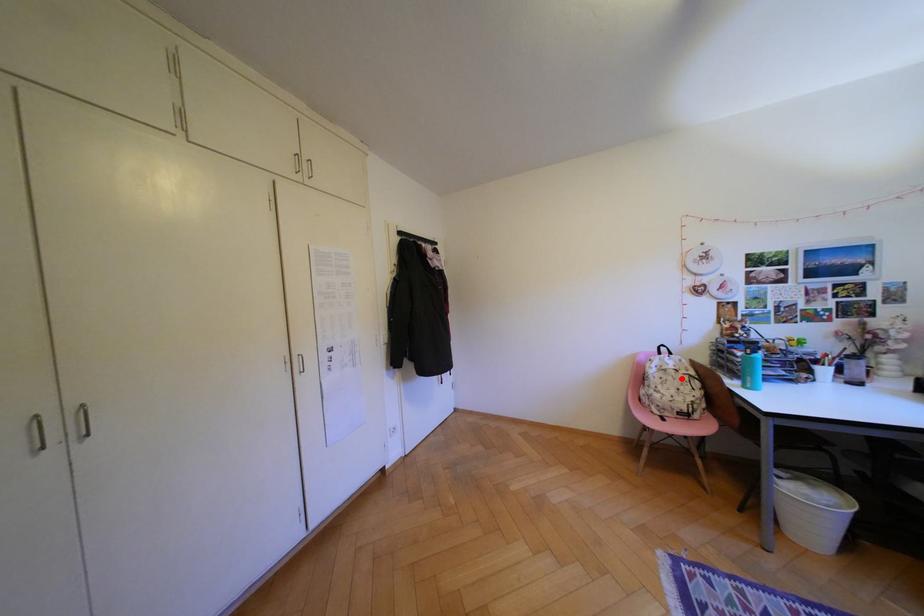
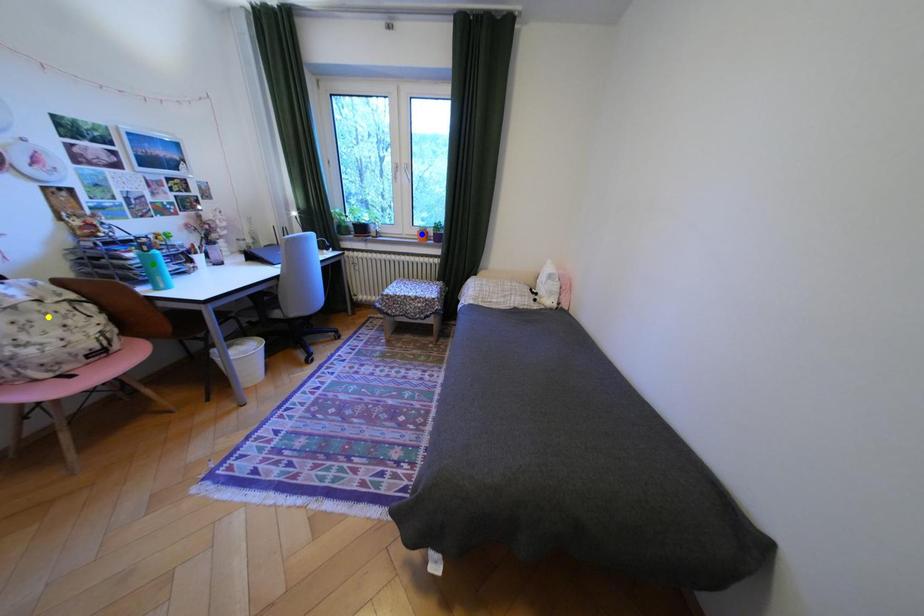
Question: I am providing you with two images of the same scene from different viewpoints. A red point is marked on the first image. You are given multiple points on the second image. Which point in image 2 is actually the same real-world point as the red point in image 1?

Choices:
 (A) green point
 (B) blue point
 (C) yellow point

Answer: (C)